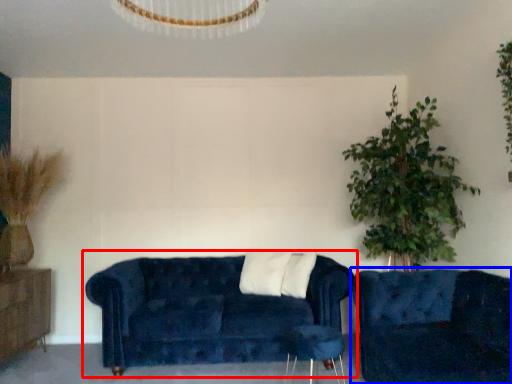
Question: Which of the following is the farthest to the observer, studio couch (highlighted by a red box) or studio couch (highlighted by a blue box)?

Choices:
 (A) studio couch
 (B) studio couch

Answer: (A)